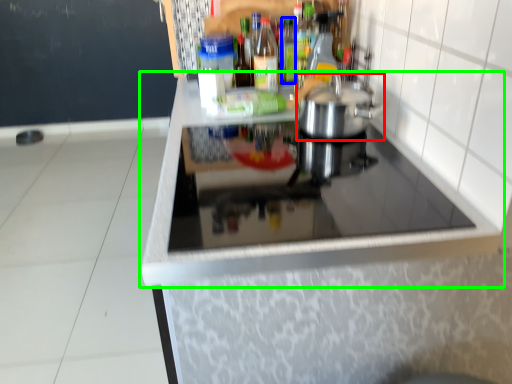
Question: Based on their relative distances, which object is nearer to kitchen appliance (highlighted by a red box)? Choose from bottle (highlighted by a blue box) and countertop (highlighted by a green box).

Choices:
 (A) bottle
 (B) countertop

Answer: (B)